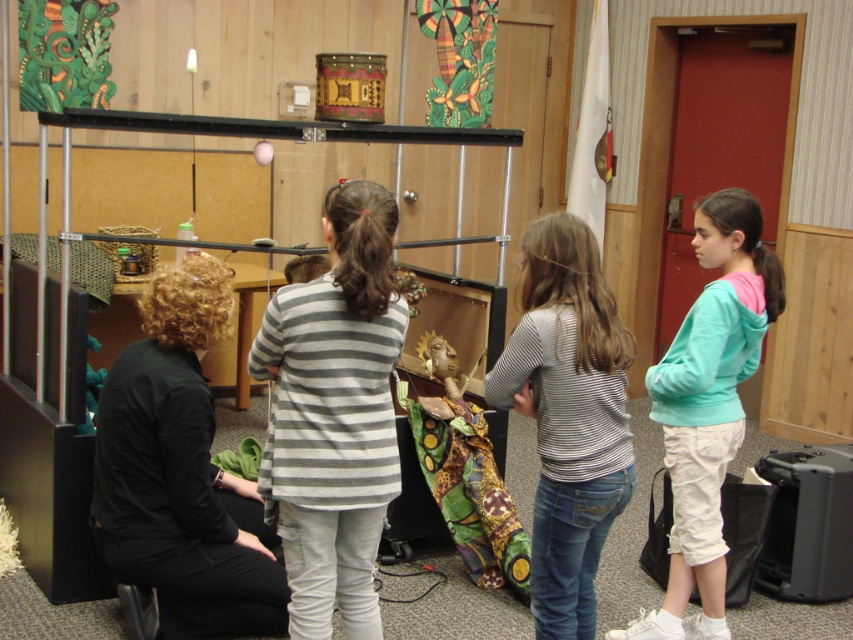
You are a photographer trying to capture a clear shot of both the teal hoodie at right and the matte brown wooden toy at center. Based on their positions, which object should you focus on first to ensure both are in frame?

The teal hoodie at right is positioned under the matte brown wooden toy at center, so focusing on the matte brown wooden toy at center first will keep both in frame as the teal hoodie at right is beneath it.

You are standing at the entrance of the community hall and see two points marked in the scene. Which point is closer to you, point (x=236, y=513) or point (x=427, y=340)?

Point (x=236, y=513) is in front of point (x=427, y=340), so it is closer to you.

You are a photographer trying to capture a clear shot of the teal hoodie at right and the matte brown wooden toy at center. Since you want both subjects in focus, which one should you adjust your camera focus on first?

The teal hoodie at right is closer to the viewer than the matte brown wooden toy at center. To ensure both are in focus, you should focus on the teal hoodie at right first, as focusing on the closer object allows the depth of field to extend to the farther object more effectively.